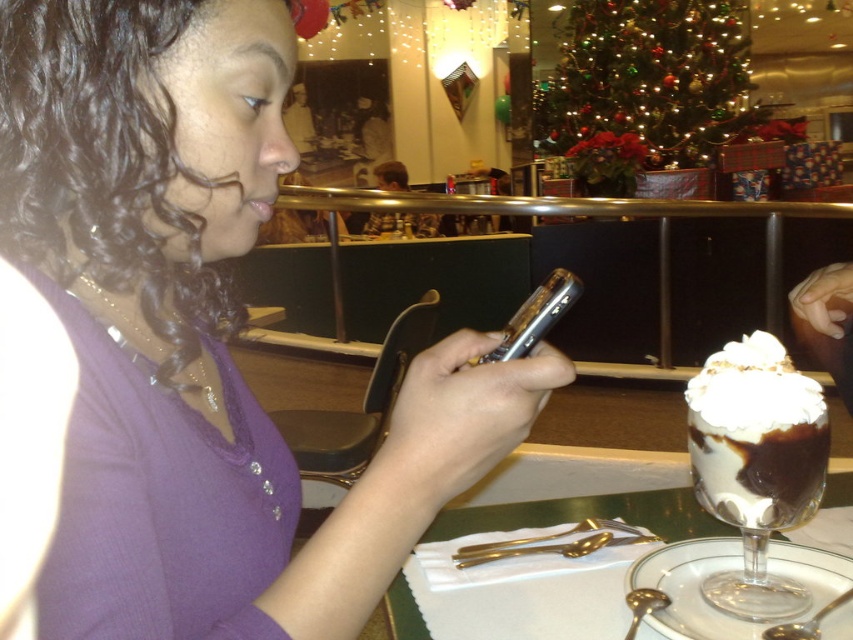
Can you confirm if purple matte shirt at center is bigger than silver metallic phone at center?

Yes, purple matte shirt at center is bigger than silver metallic phone at center.

Who is higher up, purple matte shirt at center or silver metallic phone at center?

silver metallic phone at center is higher up.

Who is more distant from viewer, (112, 6) or (550, 300)?

The point (550, 300) is behind.

You are a GUI agent. You are given a task and a screenshot of the screen. Output one action in this format:
    pyautogui.click(x=<x>, y=<y>)
    Task: Click on the purple matte shirt at center
    The image size is (853, 640).
    Given the screenshot: What is the action you would take?
    pyautogui.click(x=184, y=346)

Does purple matte shirt at center appear on the right side of clear glass dessert at lower right?

Incorrect, purple matte shirt at center is not on the right side of clear glass dessert at lower right.

This screenshot has height=640, width=853. Describe the element at coordinates (184, 346) in the screenshot. I see `purple matte shirt at center` at that location.

Which is behind, point (144, 621) or point (448, 515)?

Point (448, 515)

This screenshot has height=640, width=853. Identify the location of purple matte shirt at center. (184, 346).

Does clear glass dessert at lower right appear on the left side of silver metallic phone at center?

No, clear glass dessert at lower right is not to the left of silver metallic phone at center.

Between point (631, 499) and point (540, 289), which one is positioned in front?

Point (540, 289) is more forward.

Locate an element on the screen. Image resolution: width=853 pixels, height=640 pixels. clear glass dessert at lower right is located at coordinates (589, 515).